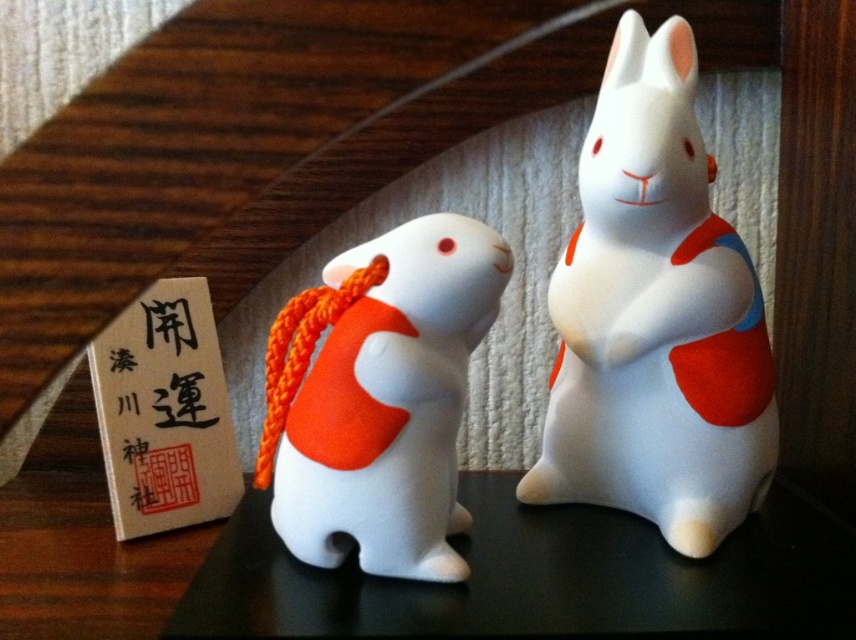
Question: Among these points, which one is farthest from the camera?

Choices:
 (A) tap(718, 323)
 (B) tap(397, 497)

Answer: (A)

Question: Is white glossy rabbit at center to the left of white matte rabbit at center from the viewer's perspective?

Choices:
 (A) yes
 (B) no

Answer: (B)

Question: Does white glossy rabbit at center have a greater width compared to white matte rabbit at center?

Choices:
 (A) yes
 (B) no

Answer: (A)

Question: Does white glossy rabbit at center lie behind white matte rabbit at center?

Choices:
 (A) yes
 (B) no

Answer: (A)

Question: Which point is closer to the camera?

Choices:
 (A) white glossy rabbit at center
 (B) white matte rabbit at center

Answer: (B)